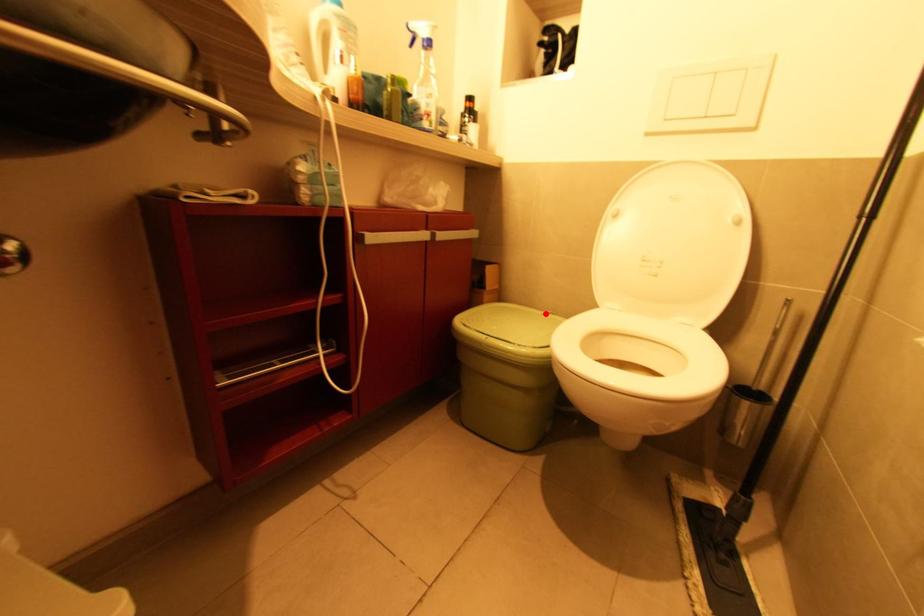
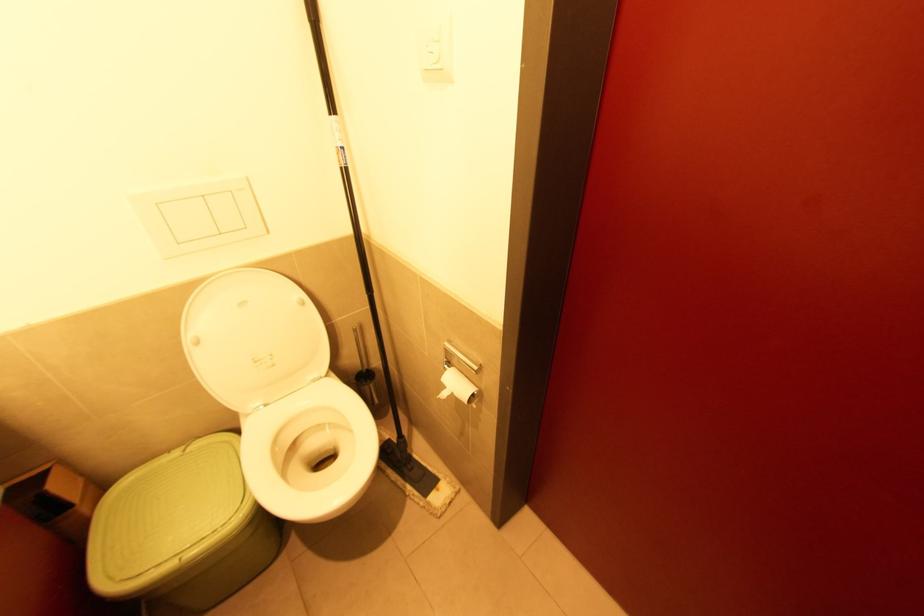
In the second image, find the point that corresponds to the highlighted location in the first image.

(187, 452)